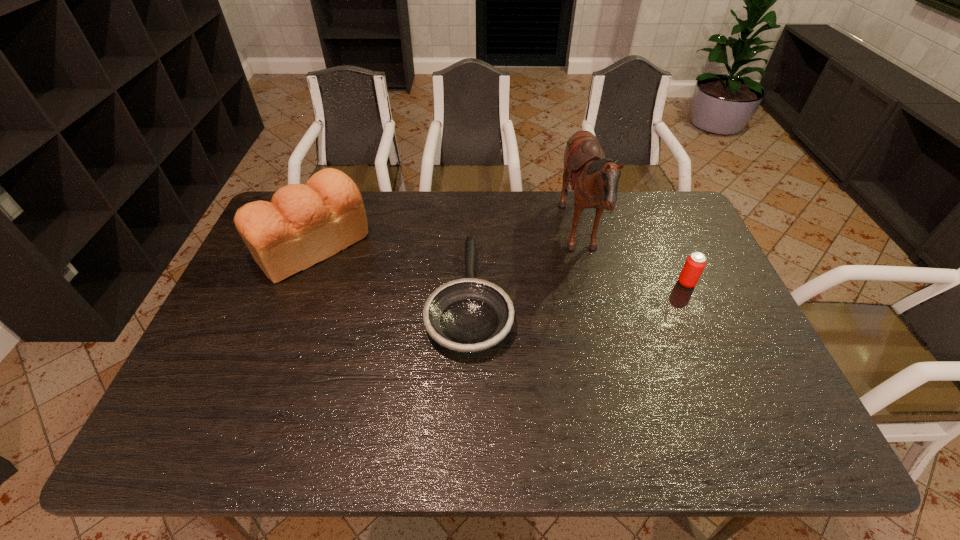
At what (x,y) coordinates should I click in order to perform the action: click on unoccupied position between the third shortest object and the saddle. Please return your answer as a coordinate pair (x, y). Looking at the image, I should click on (446, 242).

Where is `unoccupied position between the rightmost object and the shortest object`? The height and width of the screenshot is (540, 960). unoccupied position between the rightmost object and the shortest object is located at coordinates (578, 291).

Locate an element on the screen. This screenshot has height=540, width=960. empty location between the leftmost object and the saddle is located at coordinates (446, 242).

This screenshot has width=960, height=540. In order to click on free spot between the third object from right to left and the saddle in this screenshot , I will do `click(524, 268)`.

This screenshot has width=960, height=540. What are the coordinates of `vacant region between the second object from right to left and the frying pan` in the screenshot? It's located at (524, 268).

Locate an element on the screen. the second closest object to the beer can is located at coordinates (469, 315).

Identify which object is located as the second nearest to the shortest object. Please provide its 2D coordinates. Your answer should be formatted as a tuple, i.e. [(x, y)], where the tuple contains the x and y coordinates of a point satisfying the conditions above.

[(304, 224)]

In order to click on vacant space that satisfies the following two spatial constraints: 1. on the front side of the beer can; 2. on the right side of the bread in this screenshot , I will do `click(299, 283)`.

In order to click on vacant space that satisfies the following two spatial constraints: 1. on the handle side of the shortest object; 2. on the left side of the rightmost object in this screenshot , I will do `click(469, 283)`.

Identify the location of free spot that satisfies the following two spatial constraints: 1. on the back of the tallest object; 2. on the right side of the rightmost object. The width and height of the screenshot is (960, 540). (590, 283).